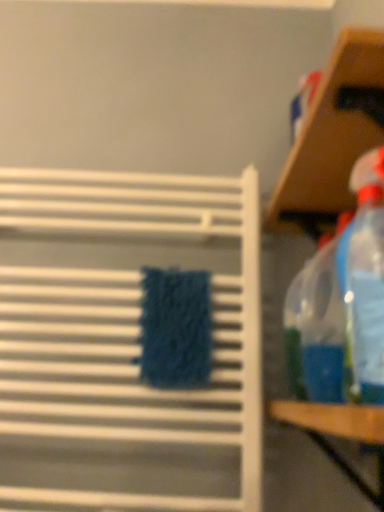
At what (x,y) coordinates should I click in order to perform the action: click on transparent plastic shelf at upper right, marked as the 2th shelf in a left-to-right arrangement. Please return your answer as a coordinate pair (x, y). This screenshot has width=384, height=512. Looking at the image, I should click on (332, 138).

Is wooden table at right a part of white textured towel rack at center, which is the 1th shelf in left-to-right order?

No.

Considering the positions of points (19, 174) and (381, 421), is point (19, 174) closer to camera compared to point (381, 421)?

No.

What's the angular difference between white textured towel rack at center, which is the 1th shelf in left-to-right order, and wooden table at right's facing directions?

They differ by 87.9 degrees in their facing directions.

Is white textured towel rack at center, which is the 1th shelf in left-to-right order, in contact with wooden table at right?

There is a gap between white textured towel rack at center, which is the 1th shelf in left-to-right order, and wooden table at right.

Is transparent plastic spray bottle at right completely or partially outside of blue fuzzy beach towel at center?

transparent plastic spray bottle at right is positioned outside blue fuzzy beach towel at center.

Looking at the image, does transparent plastic spray bottle at right seem bigger or smaller compared to blue fuzzy beach towel at center?

Considering their sizes, transparent plastic spray bottle at right takes up more space than blue fuzzy beach towel at center.

Considering the sizes of objects transparent plastic spray bottle at right and blue fuzzy beach towel at center in the image provided, who is thinner, transparent plastic spray bottle at right or blue fuzzy beach towel at center?

With smaller width is blue fuzzy beach towel at center.

From the image's perspective, is transparent plastic spray bottle at right on top of blue fuzzy beach towel at center?

Indeed, from the image's perspective, transparent plastic spray bottle at right is shown above blue fuzzy beach towel at center.

From a real-world perspective, between wooden table at right and transparent plastic spray bottle at right, who is vertically lower?

wooden table at right.

Can you confirm if wooden table at right is positioned to the left of transparent plastic spray bottle at right?

In fact, wooden table at right is to the right of transparent plastic spray bottle at right.

In the image, is wooden table at right positioned in front of or behind transparent plastic spray bottle at right?

wooden table at right is positioned closer to the viewer than transparent plastic spray bottle at right.

Could wooden table at right be considered to be inside transparent plastic shelf at upper right, which is the first shelf in right-to-left order?

Result: No, wooden table at right is not a part of transparent plastic shelf at upper right, which is the first shelf in right-to-left order.

Is transparent plastic shelf at upper right, marked as the 2th shelf in a left-to-right arrangement, taller than wooden table at right?

Indeed, transparent plastic shelf at upper right, marked as the 2th shelf in a left-to-right arrangement, has a greater height compared to wooden table at right.

In the scene shown: Is transparent plastic shelf at upper right, which is the first shelf in right-to-left order, to the left or to the right of wooden table at right in the image?

transparent plastic shelf at upper right, which is the first shelf in right-to-left order, is positioned on wooden table at right's right side.

Does transparent plastic shelf at upper right, which is the first shelf in right-to-left order, have a lesser width compared to wooden table at right?

Yes.

Is wooden table at right positioned in front of white textured towel rack at center, the second shelf when ordered from right to left?

Yes, it is.

Is wooden table at right directly adjacent to white textured towel rack at center, the second shelf when ordered from right to left?

No, wooden table at right is not beside white textured towel rack at center, the second shelf when ordered from right to left.

Which object is thinner, wooden table at right or white textured towel rack at center, the second shelf when ordered from right to left?

white textured towel rack at center, the second shelf when ordered from right to left, is thinner.

From the image's perspective, is wooden table at right beneath white textured towel rack at center, which is the 1th shelf in left-to-right order?

Correct, wooden table at right appears lower than white textured towel rack at center, which is the 1th shelf in left-to-right order, in the image.

Are transparent plastic shelf at upper right, which is the first shelf in right-to-left order, and blue fuzzy beach towel at center making contact?

They are not placed beside each other.

Considering the positions of objects transparent plastic shelf at upper right, marked as the 2th shelf in a left-to-right arrangement, and blue fuzzy beach towel at center in the image provided, who is behind, transparent plastic shelf at upper right, marked as the 2th shelf in a left-to-right arrangement, or blue fuzzy beach towel at center?

blue fuzzy beach towel at center is further away from the camera.

From the image's perspective, is transparent plastic shelf at upper right, which is the first shelf in right-to-left order, located beneath blue fuzzy beach towel at center?

No, from the image's perspective, transparent plastic shelf at upper right, which is the first shelf in right-to-left order, is not below blue fuzzy beach towel at center.

Is transparent plastic shelf at upper right, marked as the 2th shelf in a left-to-right arrangement, to the right of blue fuzzy beach towel at center from the viewer's perspective?

Indeed, transparent plastic shelf at upper right, marked as the 2th shelf in a left-to-right arrangement, is positioned on the right side of blue fuzzy beach towel at center.

Is transparent plastic shelf at upper right, which is the first shelf in right-to-left order, far from white textured towel rack at center, the second shelf when ordered from right to left?

transparent plastic shelf at upper right, which is the first shelf in right-to-left order, is actually quite close to white textured towel rack at center, the second shelf when ordered from right to left.

Looking at the image, does transparent plastic shelf at upper right, marked as the 2th shelf in a left-to-right arrangement, seem bigger or smaller compared to white textured towel rack at center, the second shelf when ordered from right to left?

Considering their sizes, transparent plastic shelf at upper right, marked as the 2th shelf in a left-to-right arrangement, takes up more space than white textured towel rack at center, the second shelf when ordered from right to left.

From the image's perspective, which one is positioned lower, transparent plastic shelf at upper right, which is the first shelf in right-to-left order, or white textured towel rack at center, which is the 1th shelf in left-to-right order?

From the image's view, white textured towel rack at center, which is the 1th shelf in left-to-right order, is below.

Which shelf is the 2nd one when counting from the back of the wooden table at right? Please provide its 2D coordinates.

[(128, 326)]

Identify the location of cleaning product above the blue fuzzy beach towel at center (from a real-world perspective). This screenshot has width=384, height=512. (349, 298).

Which object lies nearer to the anchor point white textured towel rack at center, which is the 1th shelf in left-to-right order, transparent plastic shelf at upper right, which is the first shelf in right-to-left order, or wooden table at right?

The object closer to white textured towel rack at center, which is the 1th shelf in left-to-right order, is transparent plastic shelf at upper right, which is the first shelf in right-to-left order.

In the scene shown: From the image, which object appears to be nearer to transparent plastic shelf at upper right, which is the first shelf in right-to-left order, transparent plastic spray bottle at right or blue fuzzy beach towel at center?

transparent plastic spray bottle at right.

In the scene shown: Estimate the real-world distances between objects in this image. Which object is further from white textured towel rack at center, the second shelf when ordered from right to left, wooden table at right or transparent plastic shelf at upper right, which is the first shelf in right-to-left order?

Among the two, wooden table at right is located further to white textured towel rack at center, the second shelf when ordered from right to left.

When comparing their distances from transparent plastic shelf at upper right, which is the first shelf in right-to-left order, does wooden table at right or transparent plastic spray bottle at right seem further?

wooden table at right.

Looking at the image, which one is located further to wooden table at right, transparent plastic spray bottle at right or transparent plastic shelf at upper right, marked as the 2th shelf in a left-to-right arrangement?

transparent plastic shelf at upper right, marked as the 2th shelf in a left-to-right arrangement, lies further to wooden table at right than the other object.

Considering their positions, is transparent plastic spray bottle at right positioned further to white textured towel rack at center, which is the 1th shelf in left-to-right order, than blue fuzzy beach towel at center?

Based on the image, transparent plastic spray bottle at right appears to be further to white textured towel rack at center, which is the 1th shelf in left-to-right order.

When comparing their distances from wooden table at right, does white textured towel rack at center, the second shelf when ordered from right to left, or blue fuzzy beach towel at center seem further?

white textured towel rack at center, the second shelf when ordered from right to left, lies further to wooden table at right than the other object.

From the image, which object appears to be farther from transparent plastic spray bottle at right, transparent plastic shelf at upper right, marked as the 2th shelf in a left-to-right arrangement, or blue fuzzy beach towel at center?

Based on the image, blue fuzzy beach towel at center appears to be further to transparent plastic spray bottle at right.

This screenshot has width=384, height=512. Identify the location of cleaning product situated between white textured towel rack at center, which is the 1th shelf in left-to-right order, and wooden table at right from left to right. (349, 298).

Where is `cleaning product between transparent plastic shelf at upper right, marked as the 2th shelf in a left-to-right arrangement, and blue fuzzy beach towel at center, along the z-axis`? cleaning product between transparent plastic shelf at upper right, marked as the 2th shelf in a left-to-right arrangement, and blue fuzzy beach towel at center, along the z-axis is located at coordinates (349, 298).

Find the location of `beach towel located between white textured towel rack at center, the second shelf when ordered from right to left, and transparent plastic shelf at upper right, marked as the 2th shelf in a left-to-right arrangement, in the left-right direction`. beach towel located between white textured towel rack at center, the second shelf when ordered from right to left, and transparent plastic shelf at upper right, marked as the 2th shelf in a left-to-right arrangement, in the left-right direction is located at coordinates (175, 328).

At what (x,y) coordinates should I click in order to perform the action: click on table between white textured towel rack at center, the second shelf when ordered from right to left, and transparent plastic shelf at upper right, which is the first shelf in right-to-left order. Please return your answer as a coordinate pair (x, y). This screenshot has width=384, height=512. Looking at the image, I should click on (338, 433).